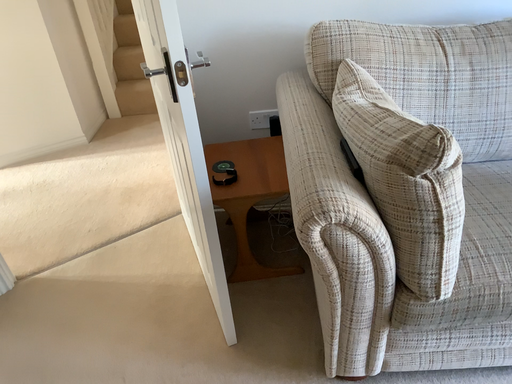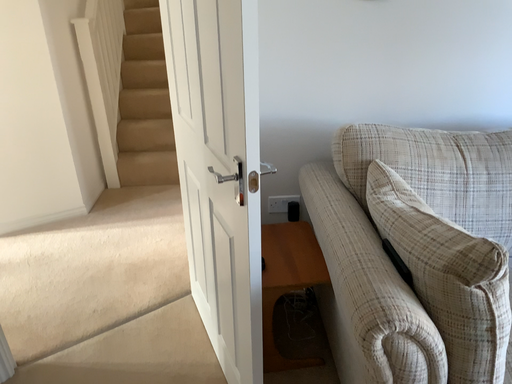
Question: How did the camera likely rotate when shooting the video?

Choices:
 (A) rotated downward
 (B) rotated upward

Answer: (B)